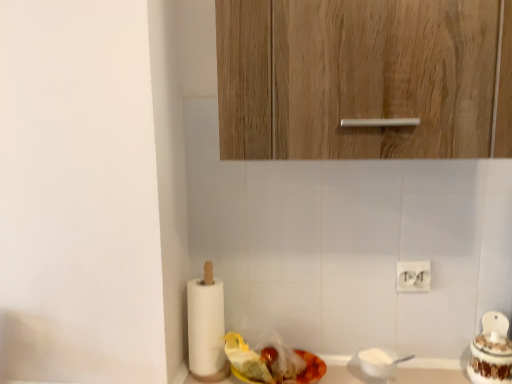
Question: From the image's perspective, is white glossy cake at right, the second food when ordered from left to right, above or below wooden cabinet at upper center?

Choices:
 (A) below
 (B) above

Answer: (A)

Question: In terms of height, does white glossy cake at right, the second food when ordered from left to right, look taller or shorter compared to wooden cabinet at upper center?

Choices:
 (A) tall
 (B) short

Answer: (B)

Question: Estimate the real-world distances between objects in this image. Which object is closer to the wooden cabinet at upper center?

Choices:
 (A) shiny plastic container at lower center, which is the first food in left-to-right order
 (B) white paper at left
 (C) white plastic electric outlet at lower right
 (D) white glossy cake at right, the second food when ordered from left to right

Answer: (C)

Question: Which object is the farthest from the wooden cabinet at upper center?

Choices:
 (A) white plastic electric outlet at lower right
 (B) white paper at left
 (C) shiny plastic container at lower center, placed as the second food when sorted from right to left
 (D) white glossy cake at right, the second food when ordered from left to right

Answer: (D)